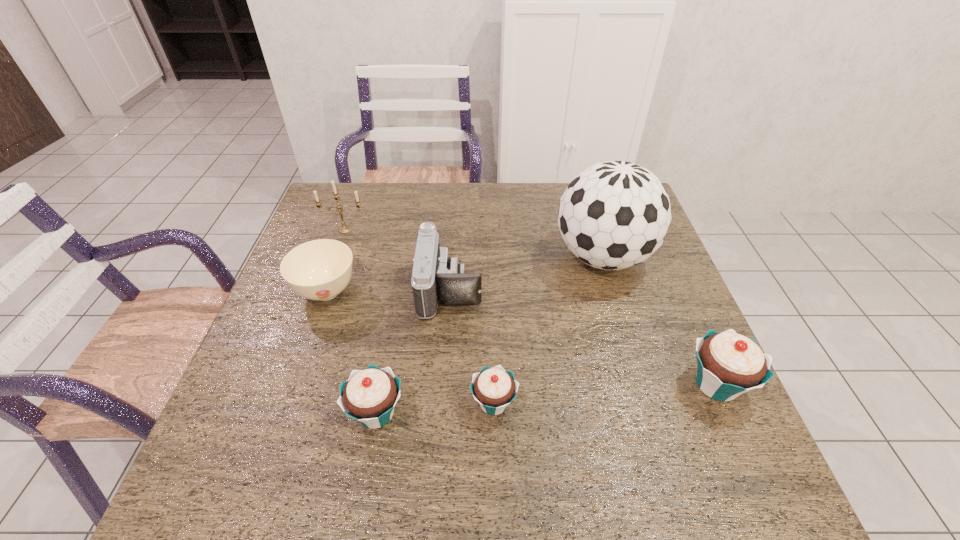
What are the coordinates of `vacant space at the near edge of the desktop` in the screenshot? It's located at (393, 418).

Identify the location of free space at the left edge of the desktop. (306, 324).

Locate an element on the screen. vacant space at the right edge is located at coordinates (x=617, y=280).

Locate an element on the screen. This screenshot has width=960, height=540. blank area at the far left corner is located at coordinates (367, 214).

Locate an element on the screen. This screenshot has height=540, width=960. vacant point located between the tallest cupcake and the second tallest cupcake is located at coordinates (546, 399).

You are a GUI agent. You are given a task and a screenshot of the screen. Output one action in this format:
    pyautogui.click(x=<x>, y=<y>)
    Task: Click on the free spot between the camera and the candle
    The image size is (960, 540).
    Given the screenshot: What is the action you would take?
    pyautogui.click(x=397, y=259)

Identify the location of free space between the camera and the tallest object. The width and height of the screenshot is (960, 540). (526, 273).

You are a GUI agent. You are given a task and a screenshot of the screen. Output one action in this format:
    pyautogui.click(x=<x>, y=<y>)
    Task: Click on the vacant area that lies between the camera and the second shortest cupcake
    The height and width of the screenshot is (540, 960).
    Given the screenshot: What is the action you would take?
    pyautogui.click(x=413, y=351)

You are a GUI agent. You are given a task and a screenshot of the screen. Output one action in this format:
    pyautogui.click(x=<x>, y=<y>)
    Task: Click on the vacant space that's between the rightmost cupcake and the camera
    Image resolution: width=960 pixels, height=540 pixels.
    Given the screenshot: What is the action you would take?
    point(584,336)

Locate an element on the screen. vacant area that lies between the second shortest cupcake and the second cupcake from right to left is located at coordinates (435, 408).